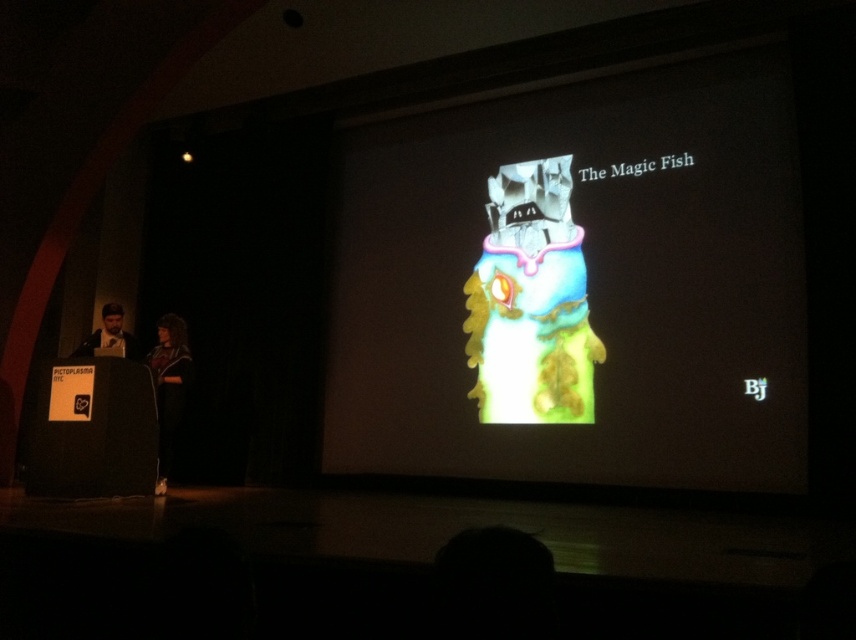
You are organizing a small event and need to place a 1.2 meter wide banner between the black cardboard speaker at lower left and the black fabric at left. Can the space between them accommodate the banner?

The black cardboard speaker at lower left is bigger than black fabric at left, but the exact distance between them isn t specified. Without knowing the actual space, it s impossible to determine if the banner will fit.

You are an event organizer setting up a presentation. You need to place a new microphone stand between the black cardboard speaker at lower left and the black fabric at left. Based on their positions, where should the microphone stand be placed relative to these two objects?

The black cardboard speaker at lower left is below the black fabric at left, so the microphone stand should be placed between them vertically, above the black cardboard speaker at lower left and below the black fabric at left.

You are an attendee at the presentation and want to see both the black fabric at left and the matte black laptop at left. Which one is closer to you?

The black fabric at left is closer to you because it is further to the viewer than the matte black laptop at left.